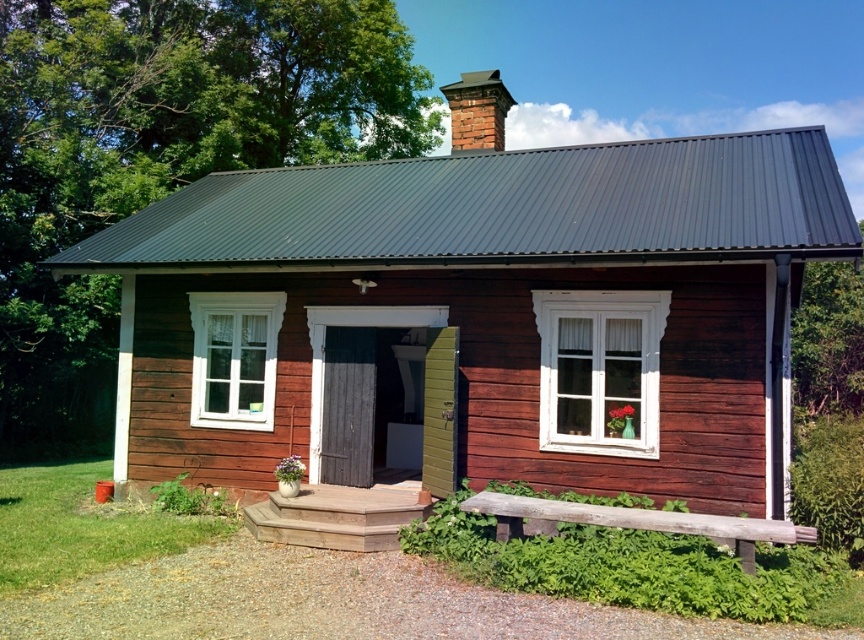
Can you confirm if smooth wooden cottage at center is shorter than red brick chimney at upper center?

Yes, smooth wooden cottage at center is shorter than red brick chimney at upper center.

Who is taller, smooth wooden cottage at center or red brick chimney at upper center?

red brick chimney at upper center is taller.

Identify the location of smooth wooden cottage at center. (480, 317).